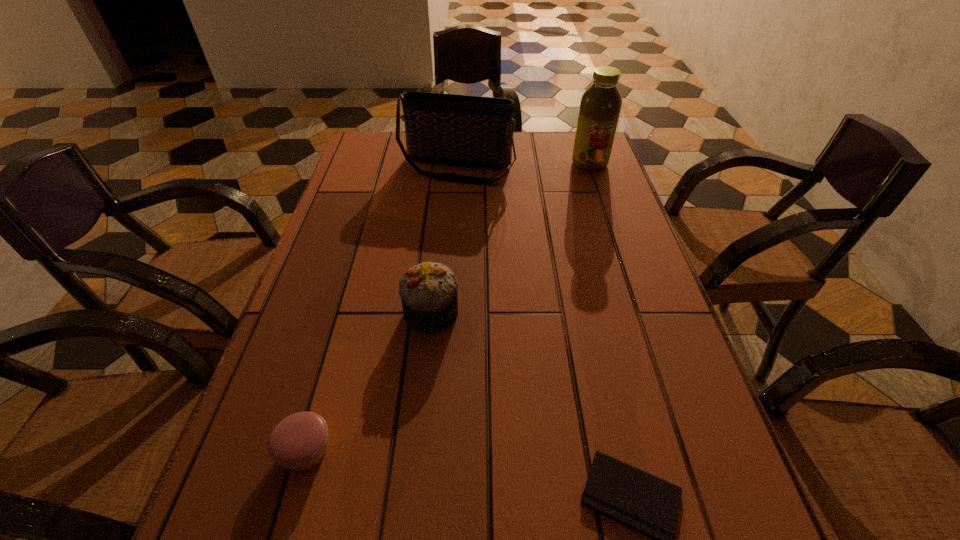
Identify the location of fruit juice. The width and height of the screenshot is (960, 540). (600, 106).

This screenshot has width=960, height=540. I want to click on the second tallest object, so click(x=475, y=131).

Identify the location of the taller cupcake. The width and height of the screenshot is (960, 540). (429, 291).

You are a GUI agent. You are given a task and a screenshot of the screen. Output one action in this format:
    pyautogui.click(x=<x>, y=<y>)
    Task: Click on the right cupcake
    Image resolution: width=960 pixels, height=540 pixels.
    Given the screenshot: What is the action you would take?
    pyautogui.click(x=429, y=291)

Locate an element on the screen. This screenshot has height=540, width=960. the second shortest object is located at coordinates (298, 442).

The height and width of the screenshot is (540, 960). What are the coordinates of `the nearer cupcake` in the screenshot? It's located at (298, 442).

This screenshot has height=540, width=960. Identify the location of vacant region located 0.170m on the front label of the fruit juice. (605, 208).

This screenshot has height=540, width=960. What are the coordinates of `free region located 0.130m on the right of the handbag` in the screenshot? It's located at (558, 168).

Identify the location of vacant space situated on the right of the farther cupcake. (604, 313).

The width and height of the screenshot is (960, 540). What are the coordinates of `vacant space situated 0.390m on the back of the left cupcake` in the screenshot? It's located at (358, 265).